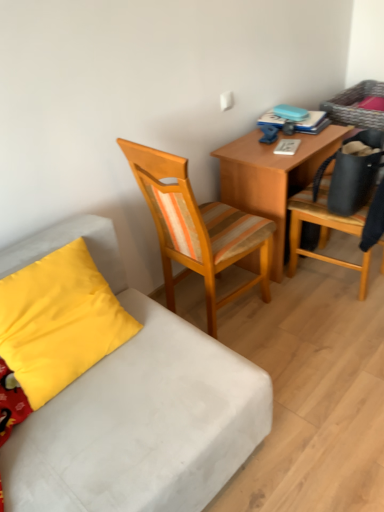
Question: Is the surface of yellow fabric pillow at lower left in direct contact with wooden desk at center?

Choices:
 (A) no
 (B) yes

Answer: (A)

Question: Is the position of yellow fabric pillow at lower left less distant than that of wooden desk at center?

Choices:
 (A) no
 (B) yes

Answer: (B)

Question: Can you confirm if yellow fabric pillow at lower left is wider than wooden desk at center?

Choices:
 (A) no
 (B) yes

Answer: (A)

Question: From the image's perspective, would you say yellow fabric pillow at lower left is shown under wooden desk at center?

Choices:
 (A) yes
 (B) no

Answer: (A)

Question: Is yellow fabric pillow at lower left oriented towards wooden desk at center?

Choices:
 (A) no
 (B) yes

Answer: (A)

Question: From the image's perspective, is yellow fabric pillow at lower left on wooden desk at center?

Choices:
 (A) no
 (B) yes

Answer: (A)

Question: Considering the relative sizes of yellow fabric pillow at lower left and white fabric studio couch at lower left in the image provided, is yellow fabric pillow at lower left thinner than white fabric studio couch at lower left?

Choices:
 (A) yes
 (B) no

Answer: (A)

Question: From the image's perspective, is yellow fabric pillow at lower left over white fabric studio couch at lower left?

Choices:
 (A) yes
 (B) no

Answer: (A)

Question: Is the position of yellow fabric pillow at lower left more distant than that of white fabric studio couch at lower left?

Choices:
 (A) no
 (B) yes

Answer: (A)

Question: Is the depth of yellow fabric pillow at lower left less than that of white fabric studio couch at lower left?

Choices:
 (A) yes
 (B) no

Answer: (A)

Question: Considering the relative sizes of yellow fabric pillow at lower left and white fabric studio couch at lower left in the image provided, is yellow fabric pillow at lower left smaller than white fabric studio couch at lower left?

Choices:
 (A) yes
 (B) no

Answer: (A)

Question: Considering the relative sizes of yellow fabric pillow at lower left and white fabric studio couch at lower left in the image provided, is yellow fabric pillow at lower left wider than white fabric studio couch at lower left?

Choices:
 (A) no
 (B) yes

Answer: (A)

Question: Can you confirm if white fabric studio couch at lower left is positioned to the right of wooden chair at right, the second chair viewed from the left?

Choices:
 (A) yes
 (B) no

Answer: (B)